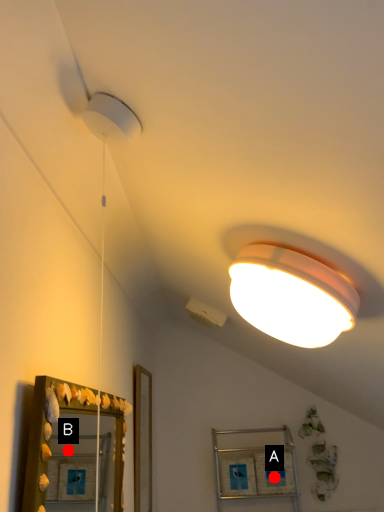
Question: Two points are circled on the image, labeled by A and B beside each circle. Among these points, which one is farthest from the camera?

Choices:
 (A) A is further
 (B) B is further

Answer: (B)